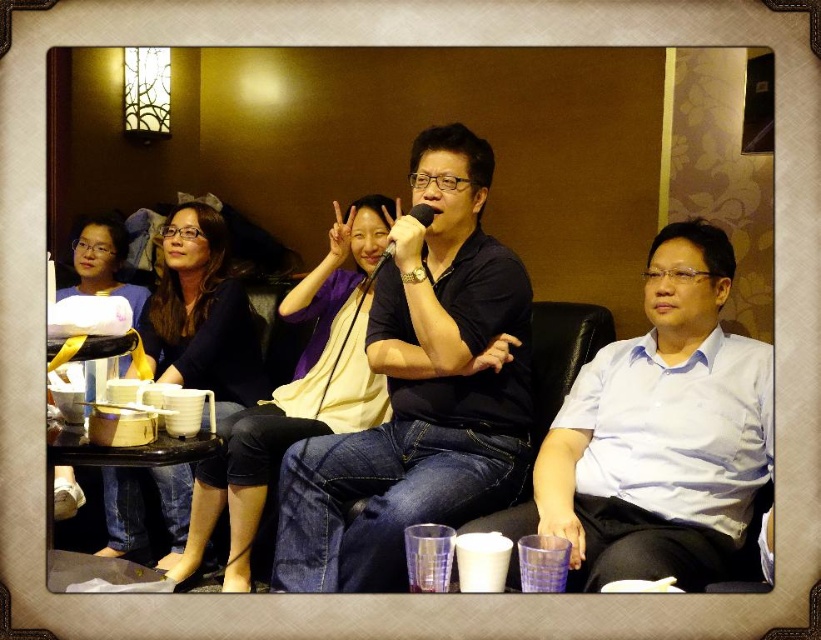
Question: Which of the following is the farthest from the observer?

Choices:
 (A) black matte shirt at center
 (B) matte black shirt at upper left
 (C) matte black shirt at center

Answer: (B)

Question: Which object is positioned closest to the matte black laptop at left?

Choices:
 (A) matte black shirt at upper left
 (B) black matte shirt at center
 (C) matte black shirt at center

Answer: (A)

Question: Is light blue shirt at center positioned behind matte black shirt at upper left?

Choices:
 (A) no
 (B) yes

Answer: (A)

Question: Among these objects, which one is nearest to the camera?

Choices:
 (A) matte black laptop at left
 (B) black matte shirt at center
 (C) light blue shirt at center

Answer: (C)

Question: Is matte black shirt at center further to the viewer compared to matte black laptop at left?

Choices:
 (A) no
 (B) yes

Answer: (A)

Question: Does black matte shirt at center appear on the left side of light blue shirt at center?

Choices:
 (A) no
 (B) yes

Answer: (B)